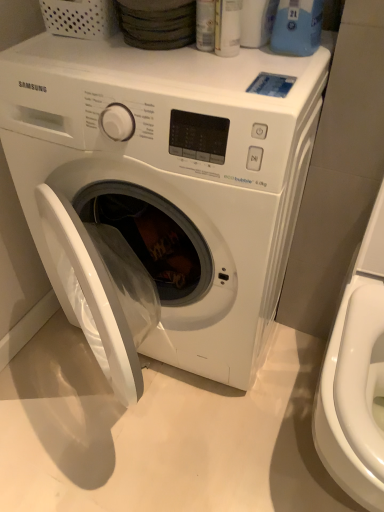
This screenshot has width=384, height=512. I want to click on white glossy washing machine at center, so click(163, 190).

Is point (83, 264) more distant than point (297, 48)?

No, it is in front of (297, 48).

Is blue plastic bottle at upper right located within white glossy washing machine at center?

No, white glossy washing machine at center does not contain blue plastic bottle at upper right.

Between white glossy washing machine at center and blue plastic bottle at upper right, which one has smaller width?

With smaller width is blue plastic bottle at upper right.

Which of these two, blue plastic bottle at upper right or white glossy washer at right, is bigger?

With larger size is white glossy washer at right.

Which of these two, blue plastic bottle at upper right or white glossy washer at right, stands taller?

white glossy washer at right is taller.

Is blue plastic bottle at upper right spatially inside white glossy washer at right, or outside of it?

blue plastic bottle at upper right exists outside the volume of white glossy washer at right.

In the scene shown: Is blue plastic bottle at upper right facing away from white glossy washer at right?

No, blue plastic bottle at upper right is not facing away from white glossy washer at right.

Is blue plastic bottle at upper right at the left side of white glossy washing machine at center?

No, blue plastic bottle at upper right is not to the left of white glossy washing machine at center.

From a real-world perspective, is blue plastic bottle at upper right on white glossy washing machine at center?

Yes, from a real-world perspective, blue plastic bottle at upper right is on top of white glossy washing machine at center.

Is blue plastic bottle at upper right thinner than white glossy washing machine at center?

Yes.

Between blue plastic bottle at upper right and white glossy washing machine at center, which one has more height?

white glossy washing machine at center.

Is white glossy washing machine at center positioned beyond the bounds of white glossy washer at right?

white glossy washing machine at center is positioned outside white glossy washer at right.

From the picture: Is white glossy washing machine at center far from white glossy washer at right?

No, white glossy washing machine at center is not far away from white glossy washer at right.

I want to click on washing machine above the white glossy washer at right (from the image's perspective), so click(163, 190).

Is white glossy washing machine at center facing towards white glossy washer at right?

No, white glossy washing machine at center is not facing towards white glossy washer at right.

From a real-world perspective, is white glossy washer at right over blue plastic bottle at upper right?

No, from a real-world perspective, white glossy washer at right is not on top of blue plastic bottle at upper right.

Which of these two, white glossy washer at right or blue plastic bottle at upper right, stands shorter?

blue plastic bottle at upper right.

From the image's perspective, who appears lower, white glossy washer at right or blue plastic bottle at upper right?

white glossy washer at right is shown below in the image.

Considering the relative sizes of white glossy washer at right and blue plastic bottle at upper right in the image provided, is white glossy washer at right bigger than blue plastic bottle at upper right?

Yes.

From the picture: Considering the sizes of white glossy washer at right and white glossy washing machine at center in the image, is white glossy washer at right bigger or smaller than white glossy washing machine at center?

Clearly, white glossy washer at right is smaller in size than white glossy washing machine at center.

Is white glossy washer at right to the left of white glossy washing machine at center from the viewer's perspective?

In fact, white glossy washer at right is to the right of white glossy washing machine at center.

Which is more distant, (381, 315) or (205, 267)?

The point (205, 267) is farther from the camera.

From a real-world perspective, which is physically below, white glossy washer at right or white glossy washing machine at center?

In real-world perspective, white glossy washing machine at center is lower.

Identify the location of cleaning product above the white glossy washing machine at center (from the image's perspective). The image size is (384, 512). (297, 27).

At what (x,y) coordinates should I click in order to perform the action: click on washer in front of the blue plastic bottle at upper right. Please return your answer as a coordinate pair (x, y). This screenshot has width=384, height=512. Looking at the image, I should click on (356, 375).

Based on their spatial positions, is blue plastic bottle at upper right or white glossy washer at right closer to white glossy washing machine at center?

white glossy washer at right.

Looking at the image, which one is located further to blue plastic bottle at upper right, white glossy washer at right or white glossy washing machine at center?

Based on the image, white glossy washer at right appears to be further to blue plastic bottle at upper right.

When comparing their distances from white glossy washer at right, does blue plastic bottle at upper right or white glossy washing machine at center seem further?

blue plastic bottle at upper right is positioned further to the anchor white glossy washer at right.

Considering their positions, is white glossy washer at right positioned closer to white glossy washing machine at center than blue plastic bottle at upper right?

Based on the image, white glossy washer at right appears to be nearer to white glossy washing machine at center.

Estimate the real-world distances between objects in this image. Which object is closer to blue plastic bottle at upper right, white glossy washing machine at center or white glossy washer at right?

white glossy washing machine at center lies closer to blue plastic bottle at upper right than the other object.

Which object lies further to the anchor point white glossy washer at right, white glossy washing machine at center or blue plastic bottle at upper right?

blue plastic bottle at upper right is positioned further to the anchor white glossy washer at right.

Image resolution: width=384 pixels, height=512 pixels. I want to click on washing machine between blue plastic bottle at upper right and white glossy washer at right vertically, so click(x=163, y=190).